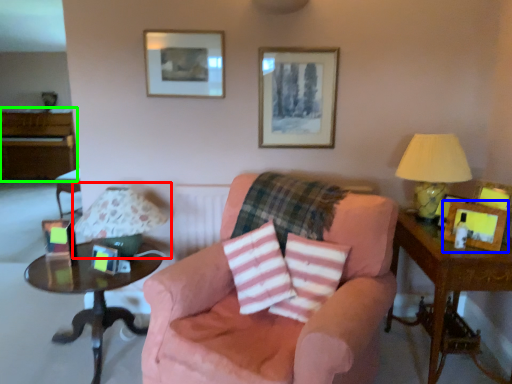
Question: Based on their relative distances, which object is nearer to table lamp (highlighted by a red box)? Choose from picture frame (highlighted by a blue box) and dresser (highlighted by a green box).

Choices:
 (A) picture frame
 (B) dresser

Answer: (A)